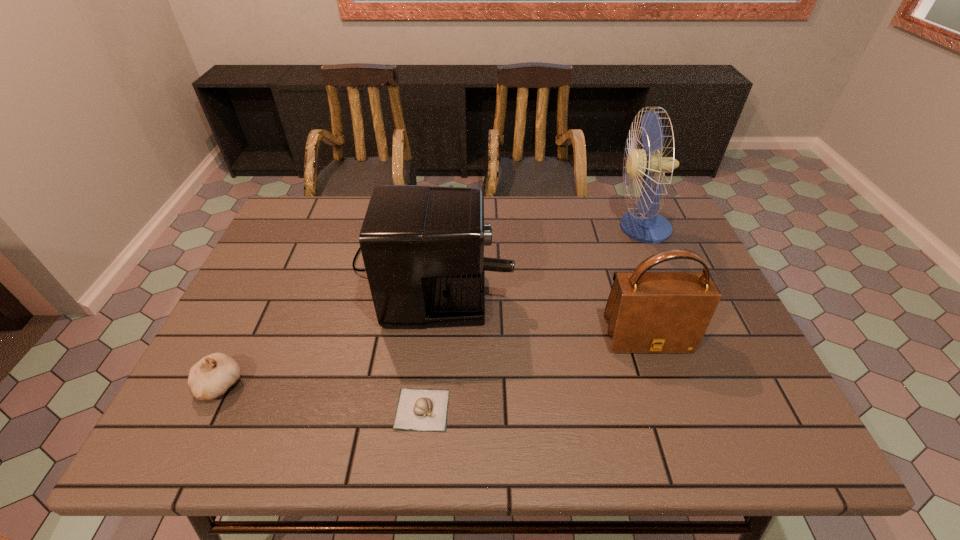
Locate an element on the screen. fan is located at coordinates (x=644, y=225).

Where is `coffee maker`? coffee maker is located at coordinates (423, 246).

In order to click on shoulder bag in this screenshot , I will do `click(650, 312)`.

The image size is (960, 540). Find the location of `the taller garlic`. the taller garlic is located at coordinates (213, 375).

Locate an element on the screen. The height and width of the screenshot is (540, 960). the left garlic is located at coordinates (213, 375).

This screenshot has height=540, width=960. I want to click on the shortest object, so click(x=418, y=409).

Where is `the shorter garlic`? the shorter garlic is located at coordinates (418, 409).

Where is `vacant area situated at the front of the tallest object where the blades are visible`? The width and height of the screenshot is (960, 540). vacant area situated at the front of the tallest object where the blades are visible is located at coordinates (536, 228).

Image resolution: width=960 pixels, height=540 pixels. I want to click on free space located 0.400m at the front of the tallest object where the blades are visible, so click(485, 228).

Locate an element on the screen. vacant space located 0.100m at the front of the tallest object where the blades are visible is located at coordinates (581, 228).